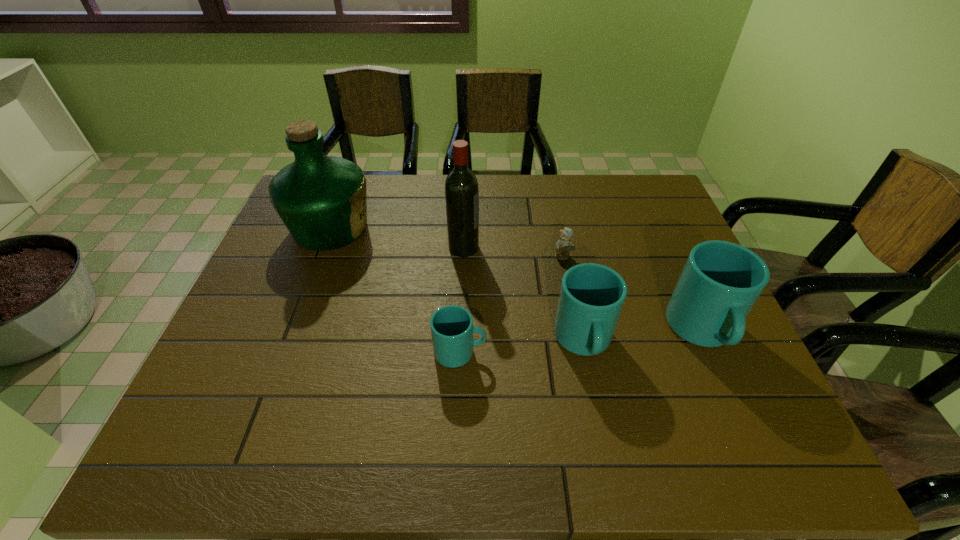
Locate an element on the screen. Image resolution: width=960 pixels, height=540 pixels. free space between the teddy bear and the rightmost object is located at coordinates (633, 294).

Where is `the second closest object to the leftmost object`? This screenshot has width=960, height=540. the second closest object to the leftmost object is located at coordinates (452, 328).

Select which object appears as the second closest to the liquor. Please provide its 2D coordinates. Your answer should be formatted as a tuple, i.e. [(x, y)], where the tuple contains the x and y coordinates of a point satisfying the conditions above.

[(452, 328)]

Locate which cup is the closest to the fourth tallest object. Please provide its 2D coordinates. Your answer should be formatted as a tuple, i.e. [(x, y)], where the tuple contains the x and y coordinates of a point satisfying the conditions above.

[(721, 281)]

Where is `cup that can be found as the closest to the second cup from left to right`? Image resolution: width=960 pixels, height=540 pixels. cup that can be found as the closest to the second cup from left to right is located at coordinates (721, 281).

This screenshot has height=540, width=960. Find the location of `free space in the image that satisfies the following two spatial constraints: 1. on the handle side of the second cup from left to right; 2. on the handle side of the fifth tallest object`. free space in the image that satisfies the following two spatial constraints: 1. on the handle side of the second cup from left to right; 2. on the handle side of the fifth tallest object is located at coordinates (586, 352).

Locate an element on the screen. vacant area that satisfies the following two spatial constraints: 1. on the handle side of the rightmost cup; 2. on the handle side of the leftmost cup is located at coordinates (711, 352).